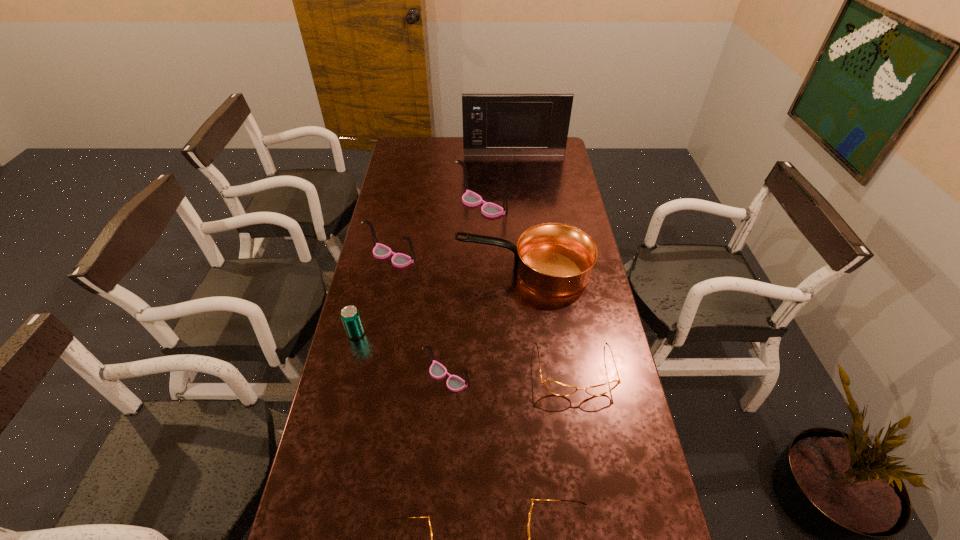
Find the location of a particular element. This screenshot has height=540, width=960. vacant space at the left edge of the desktop is located at coordinates (385, 321).

Where is `blank space at the right edge of the desktop`? The height and width of the screenshot is (540, 960). blank space at the right edge of the desktop is located at coordinates (579, 214).

The image size is (960, 540). I want to click on free space at the far left corner, so click(x=414, y=140).

In order to click on vacant point located between the farthest object and the beer can in this screenshot , I will do `click(435, 244)`.

Where is `vacant area that lies between the farthest pink spectacles and the second smallest pink spectacles`? The image size is (960, 540). vacant area that lies between the farthest pink spectacles and the second smallest pink spectacles is located at coordinates [x=437, y=231].

You are a GUI agent. You are given a task and a screenshot of the screen. Output one action in this format:
    pyautogui.click(x=<x>, y=<y>)
    Task: Click on the free spot between the frying pan and the biggest pink spectacles
    
    Given the screenshot: What is the action you would take?
    pyautogui.click(x=503, y=238)

Where is `free spot between the frying pan and the farthest pink spectacles`? free spot between the frying pan and the farthest pink spectacles is located at coordinates (503, 238).

Where is `free space between the frying pan and the fifth shortest spectacles`? free space between the frying pan and the fifth shortest spectacles is located at coordinates (458, 263).

Locate an element on the screen. This screenshot has width=960, height=540. vacant point located between the frying pan and the third shortest object is located at coordinates (549, 320).

Find the location of a particular element. free space between the teal beer can and the microwave oven is located at coordinates coord(435,244).